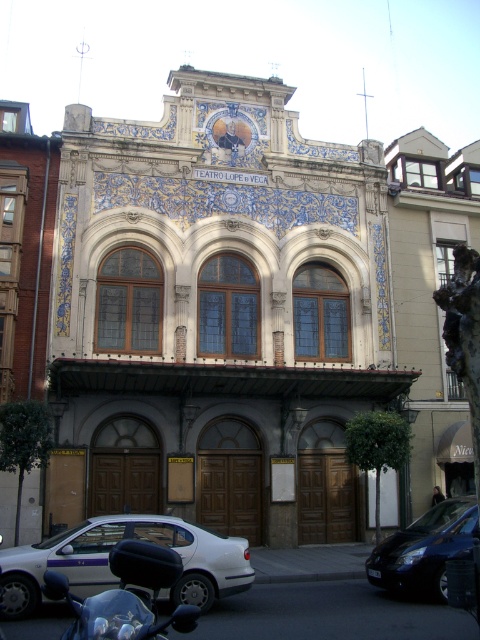
Question: Which object is closer to the camera taking this photo?

Choices:
 (A) black matte motorcycle at lower left
 (B) white glossy sedan at center

Answer: (A)

Question: Does black matte motorcycle at lower left lie behind shiny blue car at lower right?

Choices:
 (A) no
 (B) yes

Answer: (A)

Question: Is white glossy sedan at center closer to the viewer compared to black matte motorcycle at lower left?

Choices:
 (A) yes
 (B) no

Answer: (B)

Question: Among these objects, which one is farthest from the camera?

Choices:
 (A) white glossy sedan at center
 (B) shiny blue car at lower right

Answer: (B)

Question: Which point is closer to the camera?

Choices:
 (A) (110, 572)
 (B) (369, 566)
 (C) (134, 548)

Answer: (C)

Question: Is white glossy sedan at center positioned before shiny blue car at lower right?

Choices:
 (A) no
 (B) yes

Answer: (B)